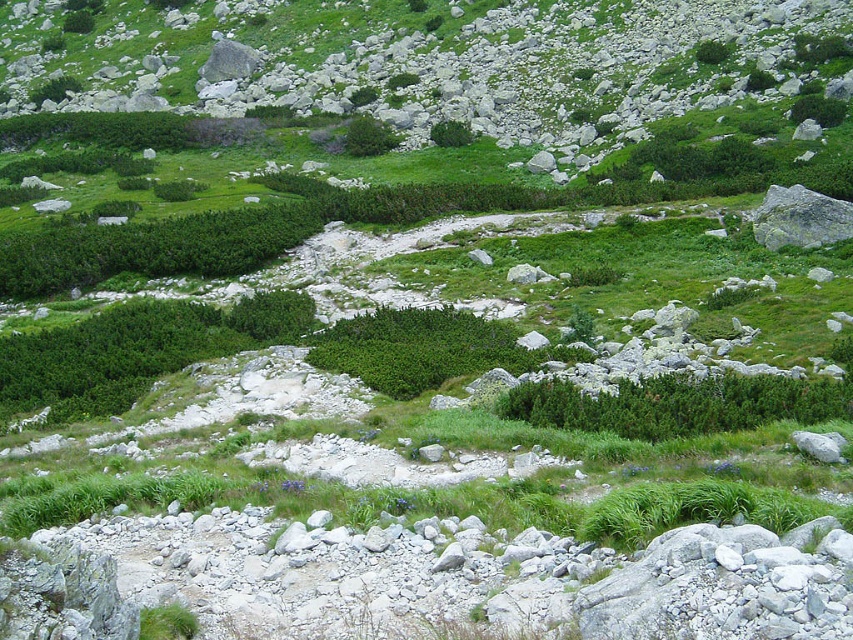
Question: Does green leafy bush at center appear over green leafy shrub at center?

Choices:
 (A) no
 (B) yes

Answer: (B)

Question: Does green leafy bush at center appear on the left side of green leafy shrub at center?

Choices:
 (A) yes
 (B) no

Answer: (A)

Question: Which point is closer to the camera?

Choices:
 (A) (444, 141)
 (B) (677, 394)

Answer: (B)

Question: Estimate the real-world distances between objects in this image. Which object is farther from the green matte shrub at center?

Choices:
 (A) green leafy shrub at center
 (B) green leafy bush at center

Answer: (B)

Question: Considering the real-world distances, which object is farthest from the green leafy shrub at center?

Choices:
 (A) green leafy bush at center
 (B) green matte shrub at center

Answer: (B)

Question: Does green leafy bush at center have a larger size compared to green leafy shrub at center?

Choices:
 (A) yes
 (B) no

Answer: (B)